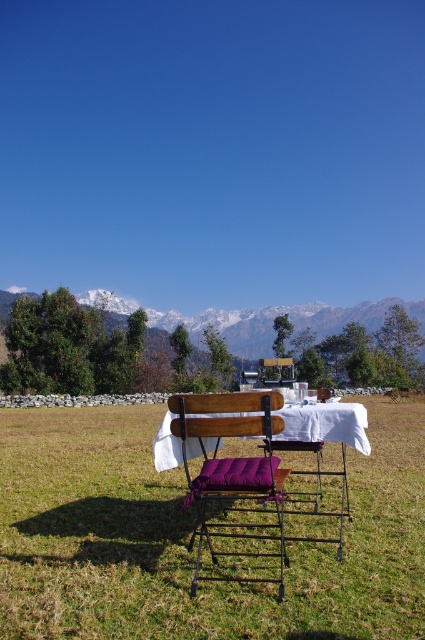
Does snowy mountain range at upper center have a lesser height compared to purple fabric table at center?

No.

Is snowy mountain range at upper center wider than purple fabric table at center?

Yes, snowy mountain range at upper center is wider than purple fabric table at center.

Between point (363, 316) and point (367, 445), which one is positioned behind?

Positioned behind is point (363, 316).

I want to click on snowy mountain range at upper center, so click(274, 316).

Does green grassy at center have a lesser height compared to purple fabric table at center?

Incorrect, green grassy at center's height does not fall short of purple fabric table at center's.

Who is taller, green grassy at center or purple fabric table at center?

green grassy at center is taller.

Is point (308, 564) positioned in front of point (166, 436)?

Yes.

Identify the location of green grassy at center. The height and width of the screenshot is (640, 425). (189, 536).

Which is more to the left, green grassy at center or purple fabric chair at center?

green grassy at center

Where is `green grassy at center`? This screenshot has width=425, height=640. green grassy at center is located at coordinates (189, 536).

The image size is (425, 640). I want to click on green grassy at center, so click(x=189, y=536).